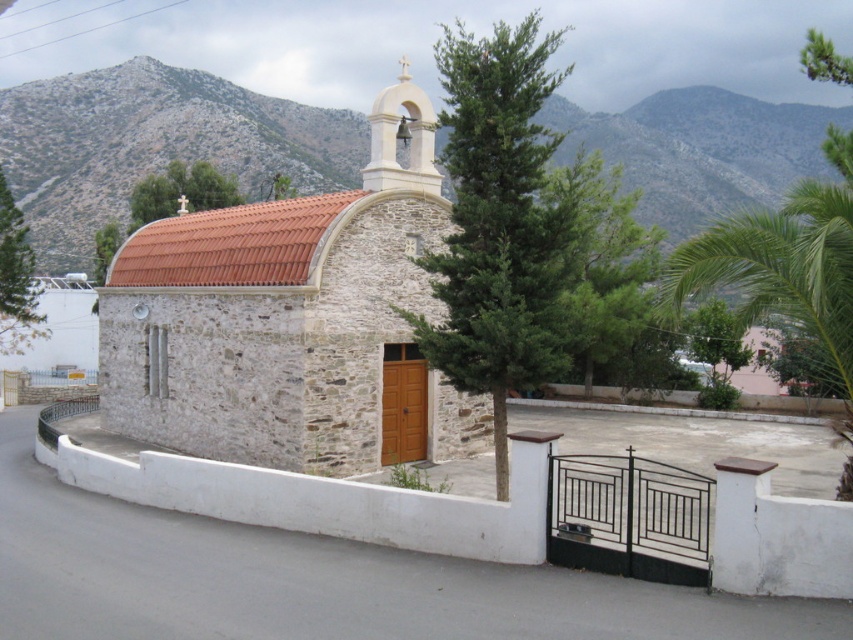
Is point (376, 195) behind point (491, 188)?

Yes, point (376, 195) is farther from viewer.

Consider the image. Is stone church at center positioned before green leafy palm tree at center?

No, it is not.

Where is `stone church at center`? The image size is (853, 640). stone church at center is located at coordinates (292, 323).

Where is `stone church at center`? This screenshot has height=640, width=853. stone church at center is located at coordinates (292, 323).

Consider the image. How much distance is there between stone church at center and green leafy tree at upper center?

The distance of stone church at center from green leafy tree at upper center is 20.75 meters.

Based on the photo, who is shorter, stone church at center or green leafy tree at upper center?

green leafy tree at upper center

Is point (375, 397) closer to camera compared to point (195, 172)?

Yes, it is.

Find the location of `stone church at center`. stone church at center is located at coordinates (292, 323).

Can you confirm if gray rocky mountain at upper center is positioned to the left of green leafy tree at upper center?

In fact, gray rocky mountain at upper center is to the right of green leafy tree at upper center.

Is gray rocky mountain at upper center to the right of green leafy tree at upper center from the viewer's perspective?

Correct, you'll find gray rocky mountain at upper center to the right of green leafy tree at upper center.

Identify the location of gray rocky mountain at upper center. 155,145.